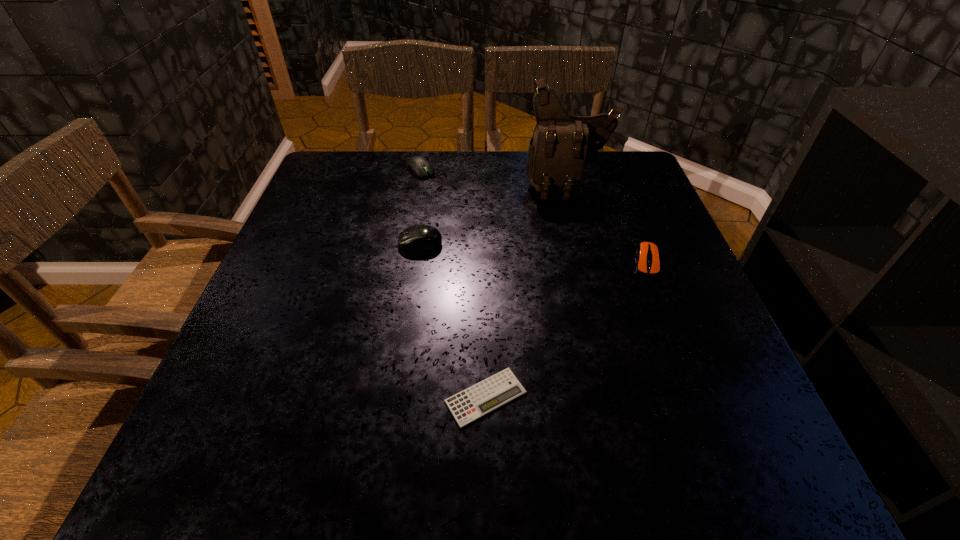
Find the location of a particular element. blank region between the shortest object and the tallest object is located at coordinates (527, 291).

At what (x,y) coordinates should I click in order to perform the action: click on free space between the tallest computer mouse and the nearest object. Please return your answer as a coordinate pair (x, y). Looking at the image, I should click on (453, 320).

Locate which object is the second closest to the third object from left to right. Please provide its 2D coordinates. Your answer should be formatted as a tuple, i.e. [(x, y)], where the tuple contains the x and y coordinates of a point satisfying the conditions above.

[(647, 254)]

In order to click on the second closest object to the tallest computer mouse in this screenshot , I will do `click(561, 144)`.

Identify which computer mouse is the second nearest to the tallest computer mouse. Please provide its 2D coordinates. Your answer should be formatted as a tuple, i.e. [(x, y)], where the tuple contains the x and y coordinates of a point satisfying the conditions above.

[(647, 254)]

Where is `computer mouse that is the second nearest to the farthest computer mouse`? The image size is (960, 540). computer mouse that is the second nearest to the farthest computer mouse is located at coordinates (647, 254).

The height and width of the screenshot is (540, 960). I want to click on free space that satisfies the following two spatial constraints: 1. on the back side of the nearest object; 2. on the right side of the rightmost computer mouse, so click(x=485, y=261).

What are the coordinates of `vacant space that satisfies the following two spatial constraints: 1. on the front-facing side of the shortest computer mouse; 2. on the right side of the tallest object` in the screenshot? It's located at click(x=587, y=261).

In order to click on free point that satisfies the following two spatial constraints: 1. on the front side of the fourth tallest object; 2. on the right side of the tallest computer mouse in this screenshot , I will do `click(418, 261)`.

Locate an element on the screen. free space that satisfies the following two spatial constraints: 1. on the front side of the nearest object; 2. on the right side of the fourth shortest object is located at coordinates (398, 397).